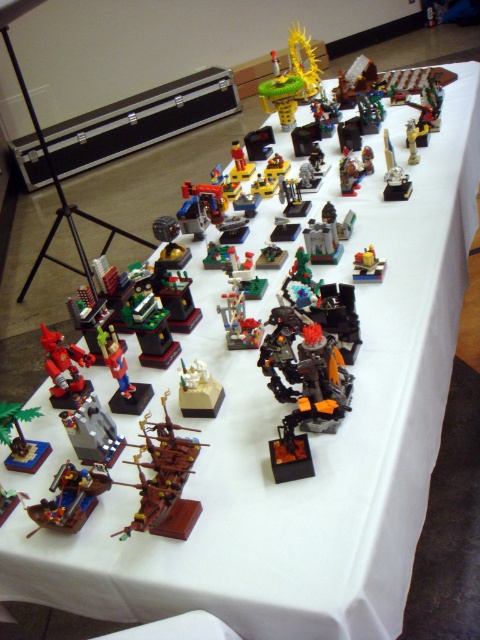
Which is in front, point (295, 384) or point (364, 248)?

Positioned in front is point (295, 384).

Measure the distance from shiny metallic robot at center to translucent yellow brick at center.

shiny metallic robot at center is 44.82 centimeters from translucent yellow brick at center.

Locate an element on the screen. This screenshot has height=640, width=480. shiny metallic robot at center is located at coordinates (305, 372).

Where is `shiny metallic robot at center`? The height and width of the screenshot is (640, 480). shiny metallic robot at center is located at coordinates (305, 372).

Can you confirm if green matte palm tree at lower left is wider than metallic silver tower at center?

No, green matte palm tree at lower left is not wider than metallic silver tower at center.

Is point (32, 451) positioned in front of point (199, 314)?

Yes, point (32, 451) is in front of point (199, 314).

Locate an element on the screen. This screenshot has width=480, height=640. green matte palm tree at lower left is located at coordinates (21, 438).

Does white matte statue at center have a greater width compared to translucent yellow brick at center?

Yes.

Is white matte statue at center bigger than translucent yellow brick at center?

Correct, white matte statue at center is larger in size than translucent yellow brick at center.

I want to click on white matte statue at center, so click(x=199, y=392).